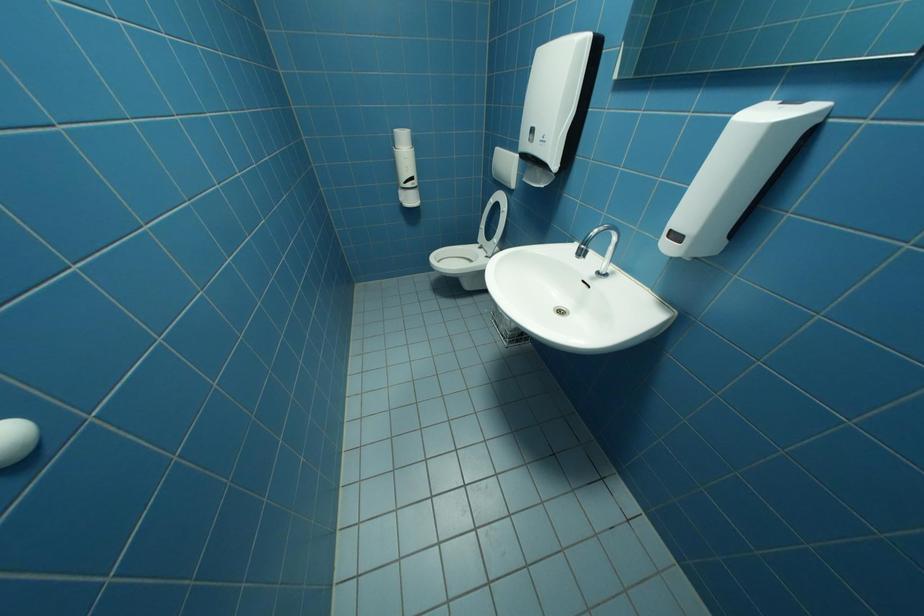
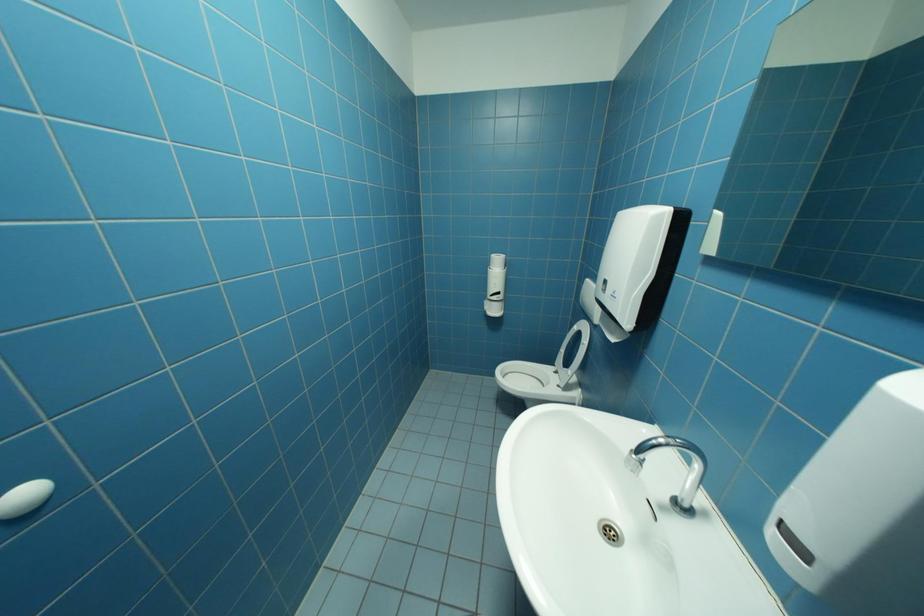
The first image is from the beginning of the video and the second image is from the end. How did the camera likely rotate when shooting the video?

The rotation direction of the camera is left-up.